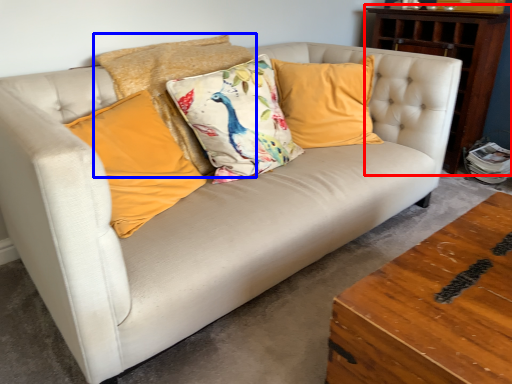
Question: Among these objects, which one is nearest to the camera, dresser (highlighted by a red box) or pillow (highlighted by a blue box)?

Choices:
 (A) dresser
 (B) pillow

Answer: (B)